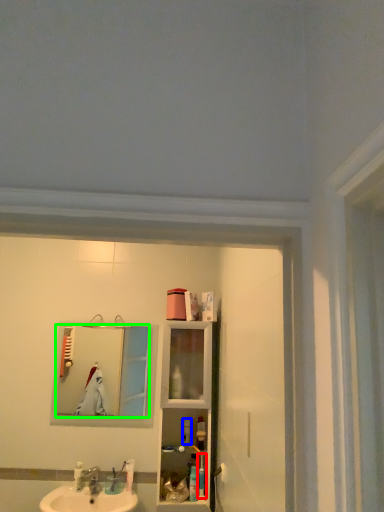
Question: Which object is the closest to the toiletry (highlighted by a red box)? Choose among these: toiletry (highlighted by a blue box) or mirror (highlighted by a green box).

Choices:
 (A) toiletry
 (B) mirror

Answer: (A)